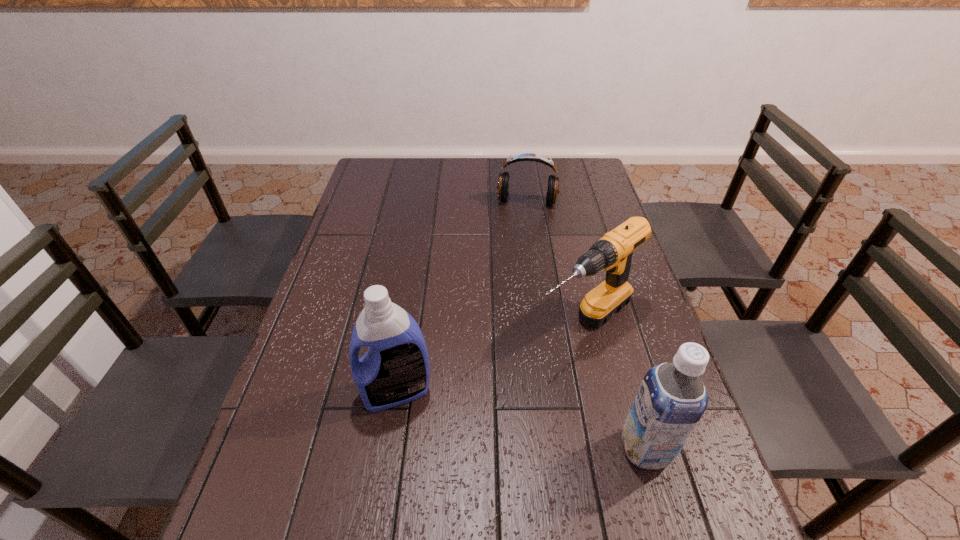
In order to click on vacant space at the left edge of the desktop in this screenshot , I will do `click(379, 196)`.

Locate an element on the screen. free space at the right edge of the desktop is located at coordinates (704, 455).

Where is `free location at the near left corner`? The height and width of the screenshot is (540, 960). free location at the near left corner is located at coordinates (309, 491).

Locate an element on the screen. empty space between the detergent and the nearest object is located at coordinates (521, 420).

Where is `free spot between the third farthest object and the farthest object`? free spot between the third farthest object and the farthest object is located at coordinates (462, 297).

Find the location of `free spot between the farthest object and the soya milk`. free spot between the farthest object and the soya milk is located at coordinates (586, 325).

This screenshot has width=960, height=540. Find the location of `free space between the soya milk and the detergent`. free space between the soya milk and the detergent is located at coordinates (521, 420).

This screenshot has height=540, width=960. In order to click on vacant region between the second farthest object and the detergent in this screenshot , I will do `click(491, 358)`.

Locate an element on the screen. The height and width of the screenshot is (540, 960). empty location between the farthest object and the soya milk is located at coordinates (586, 325).

Image resolution: width=960 pixels, height=540 pixels. What are the coordinates of `vacant space in between the leftmost object and the shortest object` in the screenshot? It's located at (462, 297).